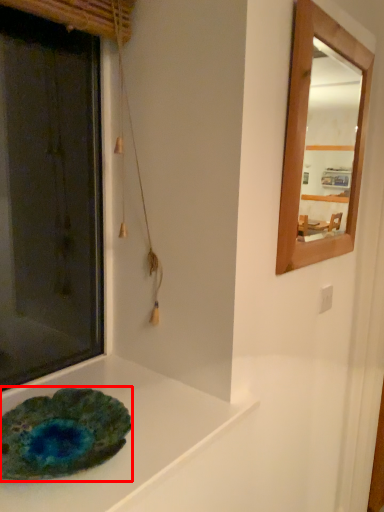
Question: From the image's perspective, what is the correct spatial positioning of glass plate (annotated by the red box) in reference to counter top?

Choices:
 (A) below
 (B) above

Answer: (B)